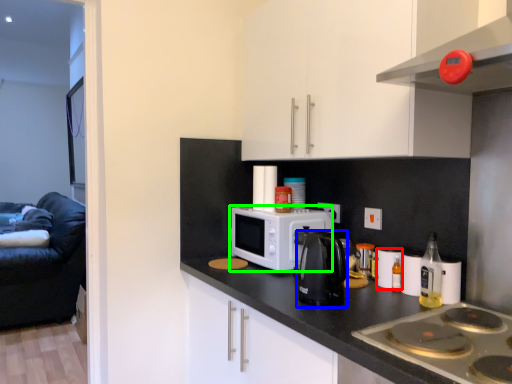
Question: Which is nearer to the appliance (highlighted by a red box)? kitchen appliance (highlighted by a blue box) or microwave oven (highlighted by a green box).

Choices:
 (A) kitchen appliance
 (B) microwave oven

Answer: (A)